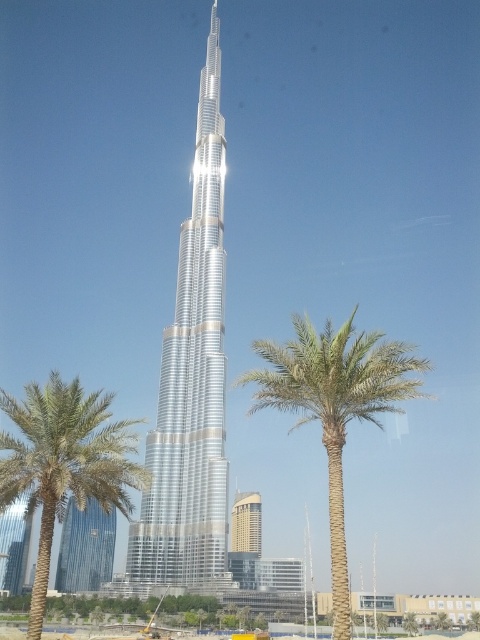
Question: Is silver metallic tower at center smaller than green leafy palm at center?

Choices:
 (A) no
 (B) yes

Answer: (B)

Question: Which point is closer to the camera?

Choices:
 (A) (172, 413)
 (B) (369, 397)
 (C) (239, 528)

Answer: (B)

Question: Which point appears farthest from the camera in this image?

Choices:
 (A) (360, 384)
 (B) (248, 525)
 (C) (27, 397)
 (D) (173, 556)

Answer: (B)

Question: Can you confirm if green leafy palm at center is positioned below gold metallic building at center?

Choices:
 (A) no
 (B) yes

Answer: (A)

Question: Among these objects, which one is farthest from the camera?

Choices:
 (A) gold metallic building at center
 (B) green leafy palm tree at center
 (C) silver metallic tower at center
 (D) green leafy palm at center

Answer: (A)

Question: Can you confirm if silver metallic tower at center is positioned to the right of green leafy palm at center?

Choices:
 (A) yes
 (B) no

Answer: (B)